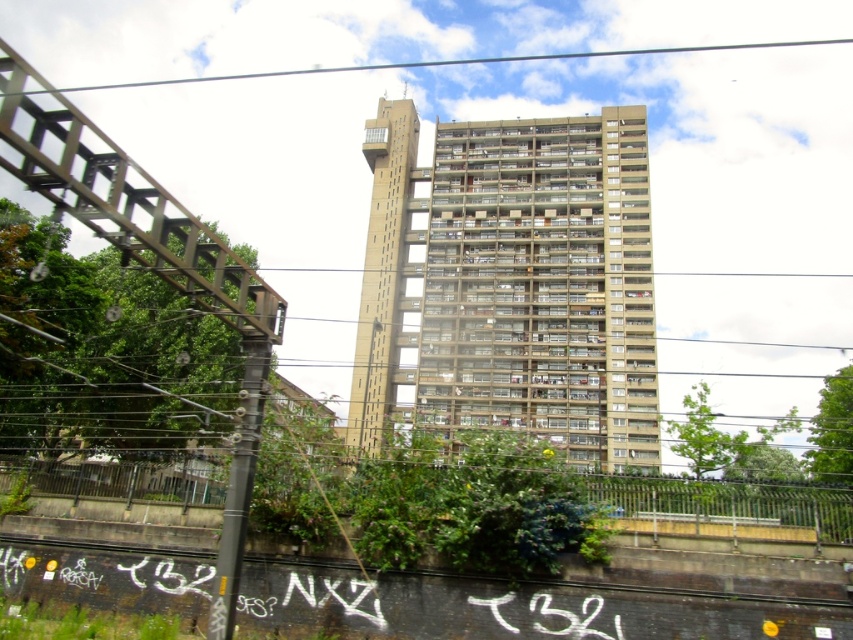
You are a city planner analyzing the urban layout. You observe the beige concrete tower block at center and the black wire at upper center in the image. Which object occupies a larger area in the scene?

The black wire at upper center occupies a larger area in the scene because the beige concrete tower block at center has a smaller size compared to it.

You are standing at the camera position and want to take a photo of the beige concrete tower block at center. If your camera can capture objects within 80 meters, will the tower block be in focus?

The beige concrete tower block at center and camera are 76.37 meters apart from each other, so yes, the tower block will be in focus as it is within the 80 meters range.

You are an urban planner assessing the view of the beige concrete tower block at center and the black wire at upper center. Which object appears narrower in the image?

The beige concrete tower block at center appears narrower than the black wire at upper center.